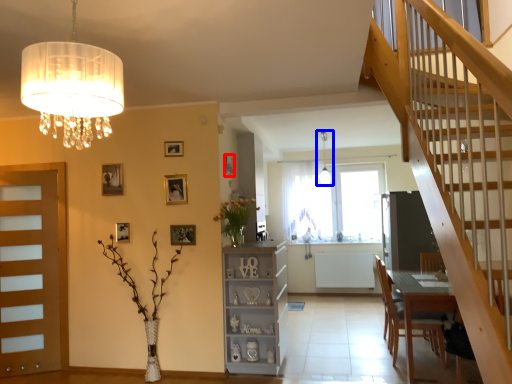
Question: Among these objects, which one is farthest to the camera, picture frame (highlighted by a red box) or light fixture (highlighted by a blue box)?

Choices:
 (A) picture frame
 (B) light fixture

Answer: (B)